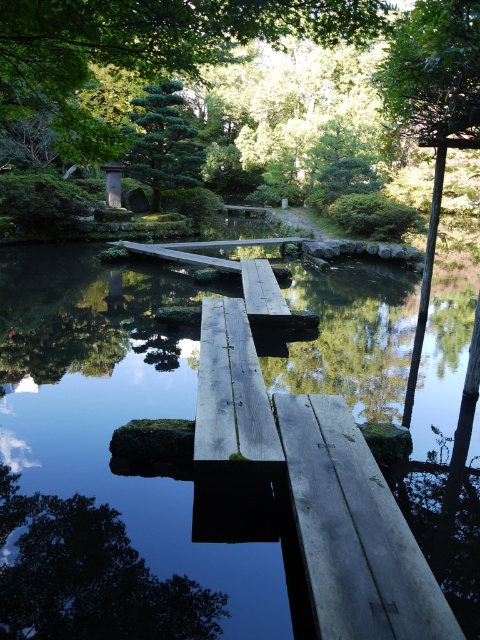
Which is behind, point (214, 323) or point (217, 257)?

The point (217, 257) is more distant.

Between wooden plank at center and wooden bridge at center, which one appears on the right side from the viewer's perspective?

wooden plank at center is more to the right.

Where is `wooden plank at center`? wooden plank at center is located at coordinates (215, 387).

Locate an element on the screen. wooden plank at center is located at coordinates (215, 387).

Which is below, green matte tree at lower left or green matte tree at upper left?

Positioned lower is green matte tree at lower left.

Which is in front, point (105, 618) or point (151, 118)?

Positioned in front is point (105, 618).

The height and width of the screenshot is (640, 480). I want to click on green matte tree at lower left, so click(x=88, y=577).

What do you see at coordinates (434, 74) in the screenshot? Image resolution: width=480 pixels, height=640 pixels. I see `green matte tree at upper right` at bounding box center [434, 74].

This screenshot has height=640, width=480. I want to click on green matte tree at upper right, so point(434,74).

This screenshot has width=480, height=640. I want to click on green matte tree at upper right, so click(x=434, y=74).